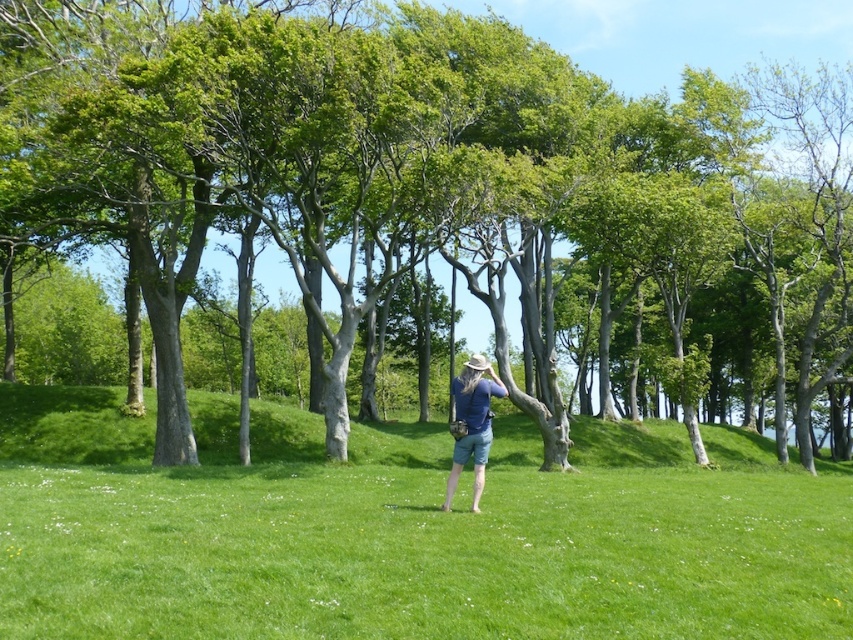
Is green grass at center below blue denim shorts at center?

Correct, green grass at center is located below blue denim shorts at center.

Does green grass at center have a lesser width compared to blue denim shorts at center?

No, green grass at center is not thinner than blue denim shorts at center.

At what (x,y) coordinates should I click in order to perform the action: click on green grass at center. Please return your answer as a coordinate pair (x, y). The width and height of the screenshot is (853, 640). Looking at the image, I should click on (405, 531).

Does green smooth tree at center have a larger size compared to green grass at center?

Correct, green smooth tree at center is larger in size than green grass at center.

Based on the photo, can you confirm if green smooth tree at center is taller than green grass at center?

Yes.

Locate an element on the screen. Image resolution: width=853 pixels, height=640 pixels. green smooth tree at center is located at coordinates (461, 180).

Find the location of a particular element. This screenshot has width=853, height=640. green smooth tree at center is located at coordinates (461, 180).

Does point (447, 128) come closer to viewer compared to point (474, 392)?

No, (447, 128) is behind (474, 392).

Which is more to the left, green smooth tree at center or blue denim shorts at center?

blue denim shorts at center is more to the left.

What do you see at coordinates (461, 180) in the screenshot? This screenshot has height=640, width=853. I see `green smooth tree at center` at bounding box center [461, 180].

Where is `green smooth tree at center`? This screenshot has height=640, width=853. green smooth tree at center is located at coordinates (461, 180).